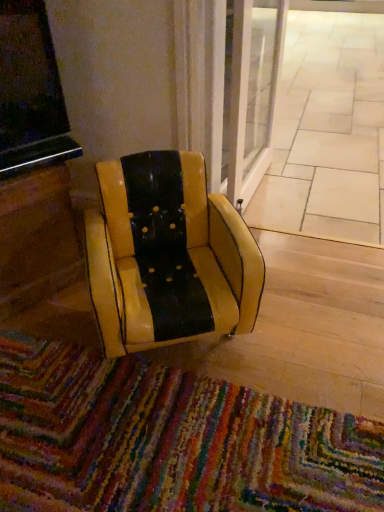
Measure the distance between yellow leather chair at center and camera.

The distance of yellow leather chair at center from camera is 3.61 feet.

Locate an element on the screen. multicolored woven mat at lower center is located at coordinates (170, 440).

The height and width of the screenshot is (512, 384). What do you see at coordinates (328, 130) in the screenshot? I see `beige tile pavement at center` at bounding box center [328, 130].

Identify the location of yellow leather chair at center. Image resolution: width=384 pixels, height=512 pixels. (168, 255).

From a real-world perspective, is multicolored woven mat at lower center physically below beige tile pavement at center?

No.

Between multicolored woven mat at lower center and beige tile pavement at center, which one appears on the right side from the viewer's perspective?

Positioned to the right is beige tile pavement at center.

Is multicolored woven mat at lower center oriented away from beige tile pavement at center?

multicolored woven mat at lower center is not turned away from beige tile pavement at center.

Considering the positions of points (159, 472) and (380, 121), is point (159, 472) closer to camera compared to point (380, 121)?

Yes.

From the image's perspective, which object appears higher, beige tile pavement at center or yellow leather chair at center?

beige tile pavement at center appears higher in the image.

Based on the photo, can you confirm if beige tile pavement at center is bigger than yellow leather chair at center?

Yes, beige tile pavement at center is bigger than yellow leather chair at center.

From a real-world perspective, is beige tile pavement at center on yellow leather chair at center?

Actually, beige tile pavement at center is physically below yellow leather chair at center in the real world.

Is beige tile pavement at center oriented away from multicolored woven mat at lower center?

No, beige tile pavement at center's orientation is not away from multicolored woven mat at lower center.

Which is closer to the camera, [327,46] or [286,480]?

The point [286,480] is more forward.

From the image's perspective, is beige tile pavement at center above multicolored woven mat at lower center?

Yes, from the image's perspective, beige tile pavement at center is over multicolored woven mat at lower center.

Is beige tile pavement at center positioned far away from multicolored woven mat at lower center?

Yes.

Looking at this image, is multicolored woven mat at lower center oriented towards yellow leather chair at center?

No, multicolored woven mat at lower center is not oriented towards yellow leather chair at center.

Is multicolored woven mat at lower center to the right of yellow leather chair at center from the viewer's perspective?

No.

From a real-world perspective, between multicolored woven mat at lower center and yellow leather chair at center, who is vertically lower?

From a 3D spatial view, multicolored woven mat at lower center is below.

Considering the sizes of objects multicolored woven mat at lower center and yellow leather chair at center in the image provided, who is bigger, multicolored woven mat at lower center or yellow leather chair at center?

With larger size is yellow leather chair at center.

Considering the sizes of objects yellow leather chair at center and multicolored woven mat at lower center in the image provided, who is shorter, yellow leather chair at center or multicolored woven mat at lower center?

multicolored woven mat at lower center.

Can you tell me how much yellow leather chair at center and multicolored woven mat at lower center differ in facing direction?

They differ by 57.3 degrees in their facing directions.

Is yellow leather chair at center further to camera compared to multicolored woven mat at lower center?

Yes, the depth of yellow leather chair at center is greater than that of multicolored woven mat at lower center.

Is yellow leather chair at center not inside multicolored woven mat at lower center?

Absolutely, yellow leather chair at center is external to multicolored woven mat at lower center.

From a real-world perspective, is yellow leather chair at center physically below beige tile pavement at center?

No.

Between yellow leather chair at center and beige tile pavement at center, which one is positioned behind?

Positioned behind is beige tile pavement at center.

Can we say yellow leather chair at center lies outside beige tile pavement at center?

Indeed, yellow leather chair at center is completely outside beige tile pavement at center.

Can you confirm if yellow leather chair at center is smaller than beige tile pavement at center?

Correct, yellow leather chair at center occupies less space than beige tile pavement at center.

In order to click on mat located on the left of beige tile pavement at center in this screenshot , I will do `click(170, 440)`.

Image resolution: width=384 pixels, height=512 pixels. In order to click on chair that is in front of the beige tile pavement at center in this screenshot , I will do `click(168, 255)`.

Considering their positions, is yellow leather chair at center positioned further to multicolored woven mat at lower center than beige tile pavement at center?

beige tile pavement at center lies further to multicolored woven mat at lower center than the other object.

Based on their spatial positions, is multicolored woven mat at lower center or beige tile pavement at center further from yellow leather chair at center?

beige tile pavement at center is further to yellow leather chair at center.

Estimate the real-world distances between objects in this image. Which object is closer to multicolored woven mat at lower center, beige tile pavement at center or yellow leather chair at center?

yellow leather chair at center.

Which object lies further to the anchor point beige tile pavement at center, yellow leather chair at center or multicolored woven mat at lower center?

multicolored woven mat at lower center.

Based on the photo, which object lies further to the anchor point yellow leather chair at center, beige tile pavement at center or multicolored woven mat at lower center?

beige tile pavement at center lies further to yellow leather chair at center than the other object.

Looking at the image, which one is located closer to beige tile pavement at center, multicolored woven mat at lower center or yellow leather chair at center?

The object closer to beige tile pavement at center is yellow leather chair at center.

Where is `chair between beige tile pavement at center and multicolored woven mat at lower center from top to bottom`? chair between beige tile pavement at center and multicolored woven mat at lower center from top to bottom is located at coordinates (168, 255).